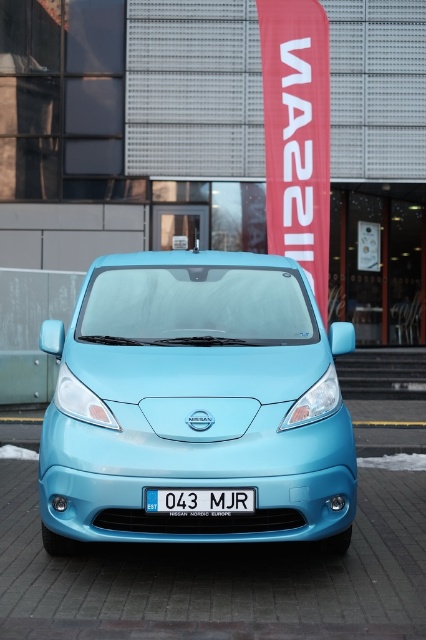
Is light blue glossy car at center positioned before white plastic license plate at center?

No, it is not.

Is light blue glossy car at center to the left of white plastic license plate at center from the viewer's perspective?

Yes, light blue glossy car at center is to the left of white plastic license plate at center.

The width and height of the screenshot is (426, 640). Identify the location of light blue glossy car at center. (195, 403).

The height and width of the screenshot is (640, 426). I want to click on light blue glossy car at center, so click(x=195, y=403).